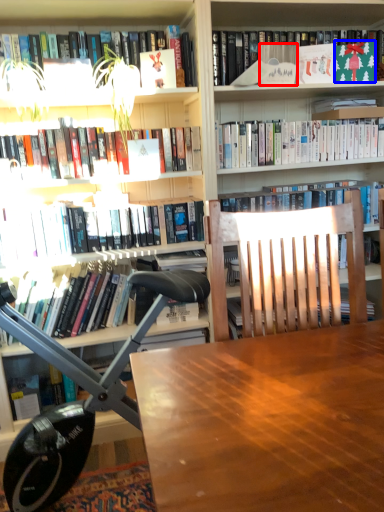
Question: Which of the following is the closest to the observer, paperback book (highlighted by a red box) or paperback book (highlighted by a blue box)?

Choices:
 (A) paperback book
 (B) paperback book

Answer: (A)